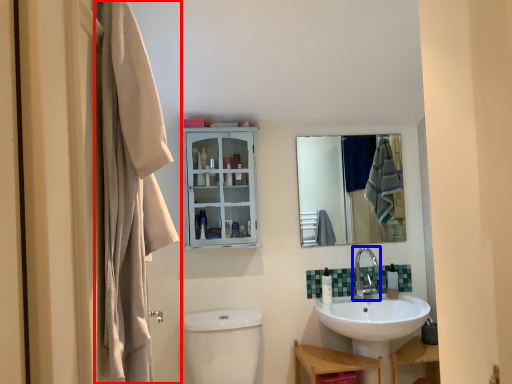
Question: Which object appears farthest to the camera in this image, curtain (highlighted by a red box) or tap (highlighted by a blue box)?

Choices:
 (A) curtain
 (B) tap

Answer: (B)